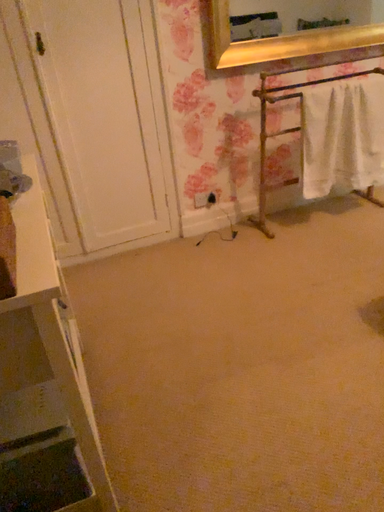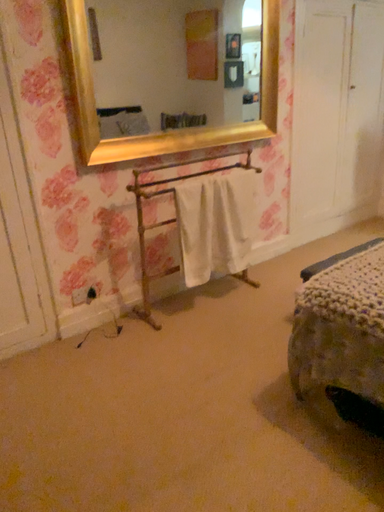
Question: How did the camera likely rotate when shooting the video?

Choices:
 (A) rotated downward
 (B) rotated upward

Answer: (B)